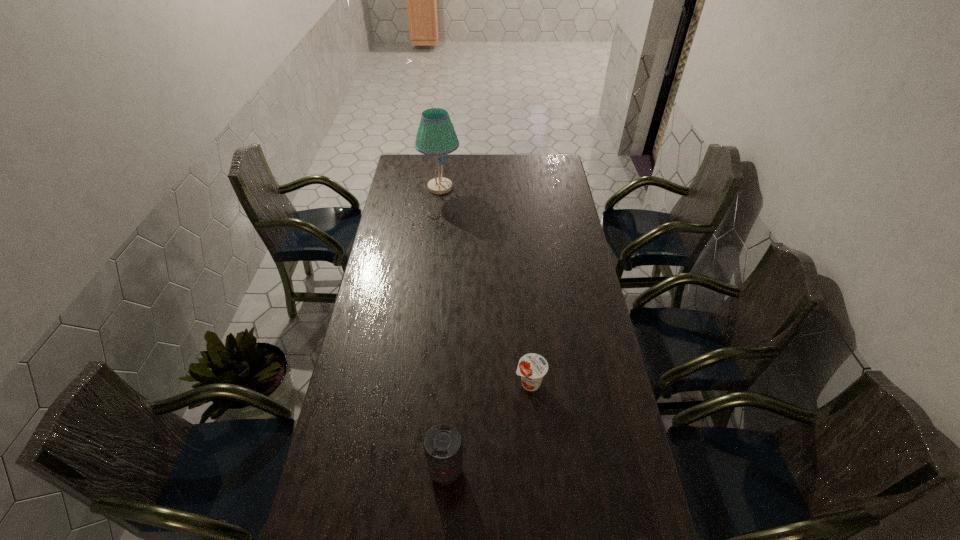
Locate an element on the screen. The image size is (960, 540). object that is at the left edge is located at coordinates (436, 136).

Image resolution: width=960 pixels, height=540 pixels. Identify the location of object at the far left corner. [436, 136].

This screenshot has height=540, width=960. Identify the location of vacant area at the far edge. (447, 167).

In order to click on free space at the left edge of the desktop in this screenshot , I will do `click(316, 491)`.

In the image, there is a desktop. At what (x,y) coordinates should I click in order to perform the action: click on vacant space at the right edge. Please return your answer as a coordinate pair (x, y). This screenshot has width=960, height=540. Looking at the image, I should click on (605, 466).

Locate an element on the screen. free point between the telephoto lens and the tallest object is located at coordinates (444, 329).

The width and height of the screenshot is (960, 540). Identify the location of empty space that is in between the left yogurt and the lamp. [x=485, y=285].

Where is `blank region between the second nearest object and the second shortest object`? Image resolution: width=960 pixels, height=540 pixels. blank region between the second nearest object and the second shortest object is located at coordinates (488, 427).

Find the location of a particular element. free space that is in between the left yogurt and the tallest object is located at coordinates (485, 285).

Identify the location of vacant point located between the taller yogurt and the tallest object. (485, 285).